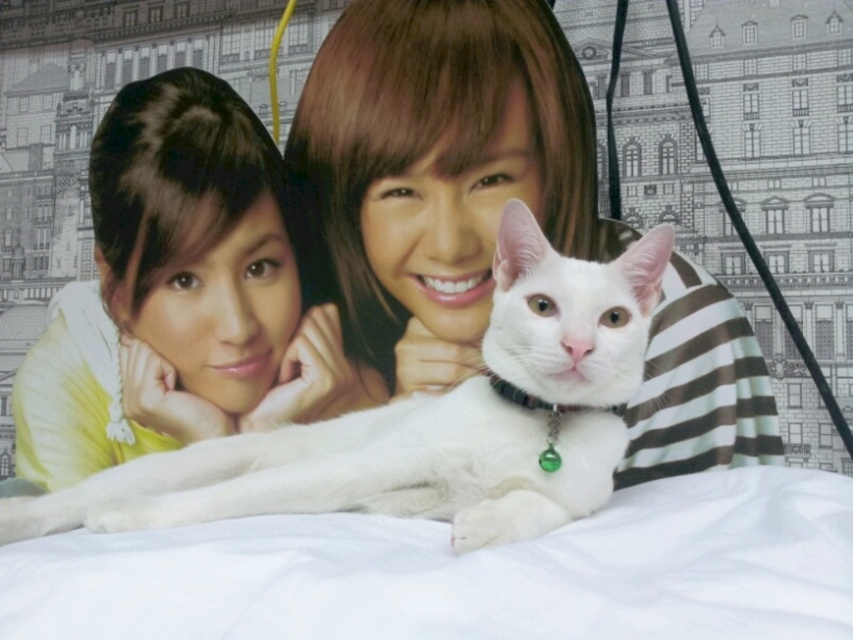
Who is positioned more to the right, smooth brown hair at center or white fur cat at center?

Positioned to the right is smooth brown hair at center.

Is smooth brown hair at center to the right of white fur cat at center from the viewer's perspective?

Yes, smooth brown hair at center is to the right of white fur cat at center.

Does point (461, 13) come closer to viewer compared to point (125, 504)?

That is False.

Find the location of a particular element. smooth brown hair at center is located at coordinates (442, 164).

Is point (88, 321) less distant than point (96, 513)?

No, (88, 321) is behind (96, 513).

Describe the element at coordinates (184, 294) in the screenshot. I see `smooth yellow shirt at upper left` at that location.

I want to click on smooth yellow shirt at upper left, so click(184, 294).

Is smooth brown hair at center bigger than smooth yellow shirt at upper left?

Yes.

Who is more distant from viewer, (352, 180) or (50, 413)?

The point (50, 413) is more distant.

This screenshot has height=640, width=853. What do you see at coordinates (442, 164) in the screenshot?
I see `smooth brown hair at center` at bounding box center [442, 164].

Locate an element on the screen. The image size is (853, 640). smooth brown hair at center is located at coordinates (442, 164).